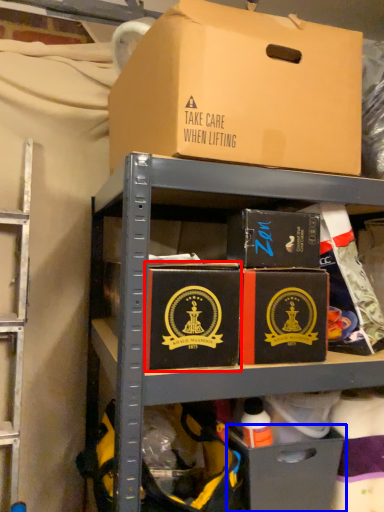
Question: Which object is closer to the camera taking this photo, box (highlighted by a red box) or drawer (highlighted by a blue box)?

Choices:
 (A) box
 (B) drawer

Answer: (A)